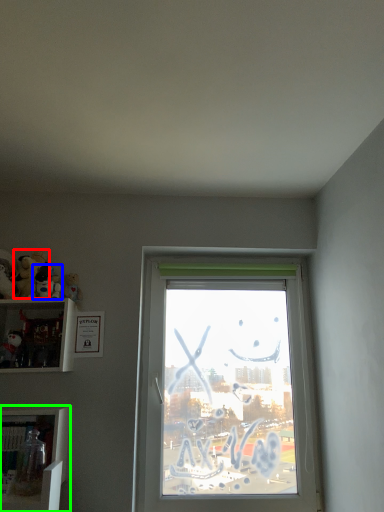
Question: Based on their relative distances, which object is nearer to toy (highlighted by a red box)? Choose from toy (highlighted by a blue box) and shelf (highlighted by a green box).

Choices:
 (A) toy
 (B) shelf

Answer: (A)